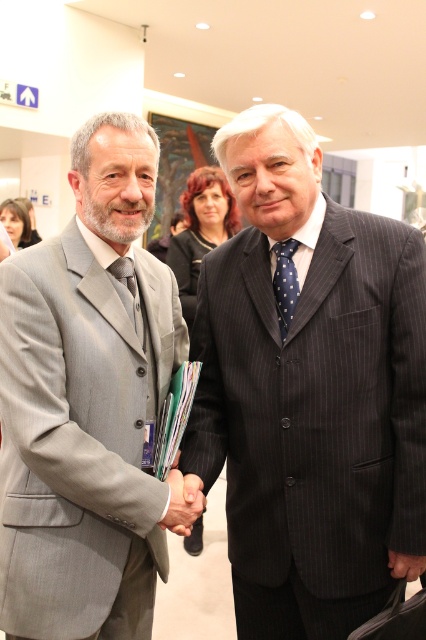
Is matte black hand at center above matte black tie at center?

No, matte black hand at center is not above matte black tie at center.

Is matte black hand at center bigger than matte black tie at center?

Indeed, matte black hand at center has a larger size compared to matte black tie at center.

Is point (166, 525) less distant than point (129, 294)?

Yes, point (166, 525) is closer to viewer.

Where is `matte black hand at center`? matte black hand at center is located at coordinates (183, 502).

Can you confirm if pinstriped suit at center is shorter than polka dot silk tie at center?

No.

Does pinstriped suit at center have a greater width compared to polka dot silk tie at center?

Yes, pinstriped suit at center is wider than polka dot silk tie at center.

Is point (412, 499) positioned in front of point (296, 243)?

Yes, it is.

This screenshot has height=640, width=426. I want to click on pinstriped suit at center, so pos(310,392).

From the picture: Does matte gray suit at left have a lesser height compared to polka dot silk tie at center?

In fact, matte gray suit at left may be taller than polka dot silk tie at center.

Between matte gray suit at left and polka dot silk tie at center, which one appears on the left side from the viewer's perspective?

Positioned to the left is matte gray suit at left.

Is point (86, 554) farther from viewer compared to point (298, 289)?

That is False.

The height and width of the screenshot is (640, 426). What are the coordinates of `matte gray suit at left` in the screenshot? It's located at (86, 404).